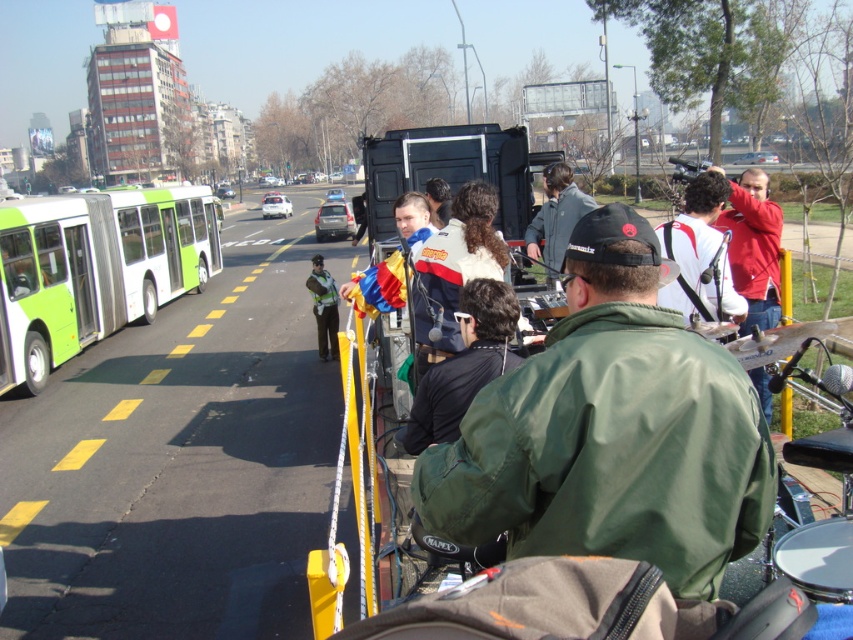
You are standing at the point closer to the camera between the two points, point (769, 284) and point (694, 209). Which point are you standing at?

You are standing at point (769, 284) because it is further to the camera than point (694, 209).

You are a photographer trying to capture the musicians in the foreground. You notice the red jacket at upper right and the white fabric shirt at upper right. Which clothing item is narrower when viewed from your position?

The red jacket at upper right is thinner than the white fabric shirt at upper right, so the red jacket at upper right is narrower.

You are a photographer trying to capture a photo of the green matte jacket at center and the red jacket at upper right. Which jacket should you focus on first if you want to include both in your shot without moving the camera?

The green matte jacket at center is not as tall as the red jacket at upper right, so you should focus on the red jacket at upper right first to ensure both are in frame.